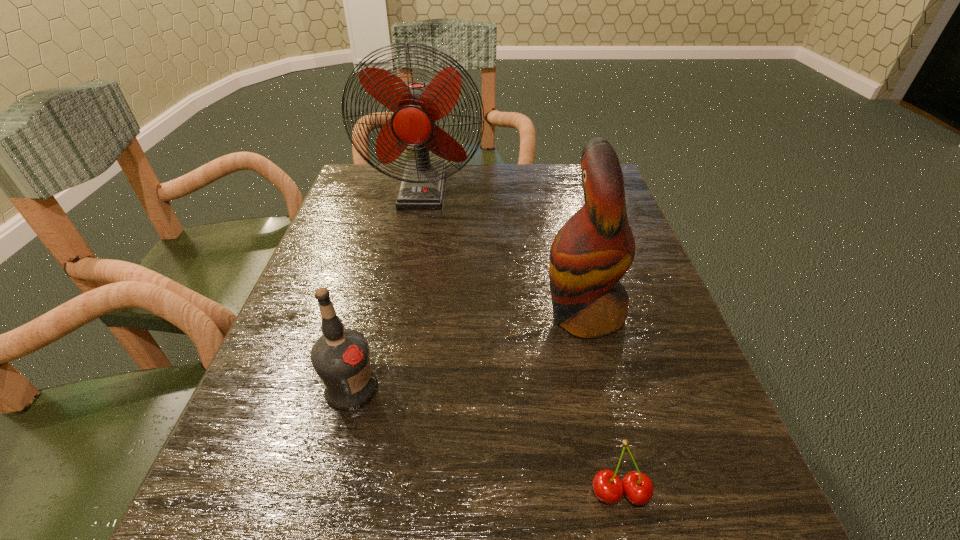
Where is `vacant space situated on the front label of the second shortest object`? This screenshot has height=540, width=960. vacant space situated on the front label of the second shortest object is located at coordinates (608, 388).

The width and height of the screenshot is (960, 540). What are the coordinates of `object that is at the far edge` in the screenshot? It's located at (416, 106).

Find the location of a particular element. The image size is (960, 540). object that is at the near edge is located at coordinates (638, 488).

The width and height of the screenshot is (960, 540). Find the location of `fan that is at the left edge`. fan that is at the left edge is located at coordinates (416, 106).

In order to click on vodka that is at the left edge in this screenshot , I will do `click(340, 357)`.

Find the location of `parrot at the right edge`. parrot at the right edge is located at coordinates (593, 250).

Locate an element on the screen. Image resolution: width=960 pixels, height=540 pixels. cherry at the right edge is located at coordinates (638, 488).

The height and width of the screenshot is (540, 960). I want to click on object located in the far left corner section of the desktop, so click(x=416, y=106).

The width and height of the screenshot is (960, 540). I want to click on object that is at the near right corner, so click(638, 488).

This screenshot has width=960, height=540. I want to click on vacant space at the far edge of the desktop, so click(503, 204).